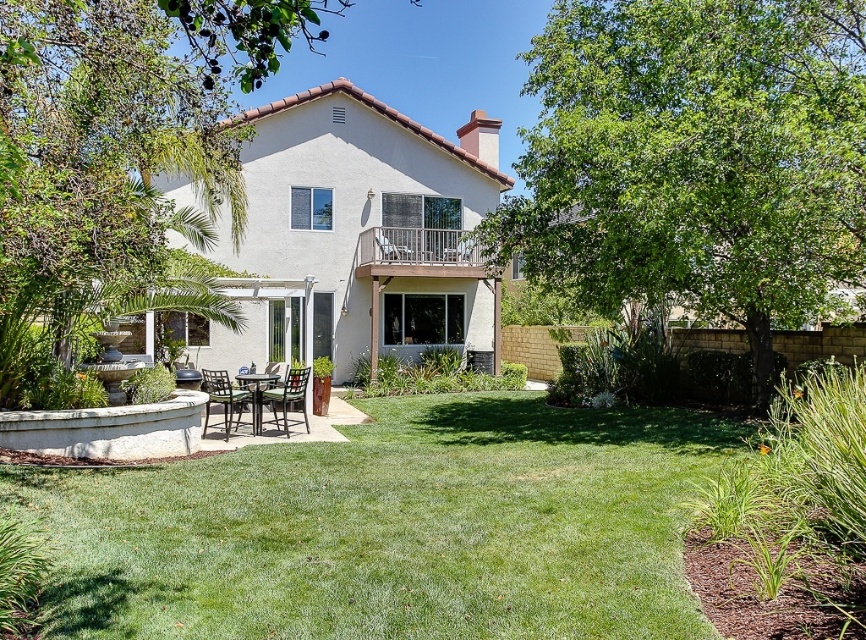
Can you confirm if green grass at center is positioned above green leafy tree at upper left?

Actually, green grass at center is below green leafy tree at upper left.

Does green grass at center appear under green leafy tree at upper left?

Yes, green grass at center is below green leafy tree at upper left.

Locate an element on the screen. green grass at center is located at coordinates (391, 529).

Is green leafy tree at center positioned in front of brown wooden chair at lower center?

That is True.

Does green leafy tree at center have a greater height compared to brown wooden chair at lower center?

Yes.

This screenshot has height=640, width=866. I want to click on green leafy tree at center, so click(x=695, y=157).

Is green grass at center shorter than metallic silver chair at center?

Yes, green grass at center is shorter than metallic silver chair at center.

Can you confirm if green grass at center is positioned below metallic silver chair at center?

Indeed, green grass at center is positioned under metallic silver chair at center.

I want to click on green grass at center, so click(x=391, y=529).